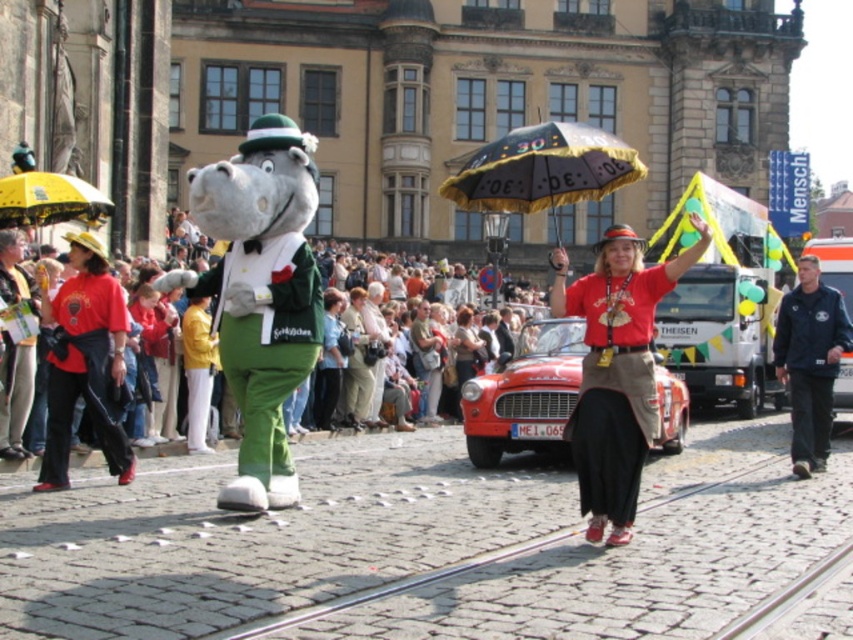
You are a photographer trying to capture a photo of the red cotton shirt at center and the yellow fabric umbrella at upper left. Which object should you focus on first if you want to include both in your shot without moving the camera?

The red cotton shirt at center is much taller than the yellow fabric umbrella at upper left, so you should focus on the red cotton shirt at center first to ensure it fits within the frame.

You are a photographer trying to capture the shiny red car at center in your shot. The camera has a focal length of 50mm and you are positioned at the origin point. What is the angle of view required to ensure the car is centered in the frame?

The shiny red car at center is located at coordinates (525, 394). To center it in the frame with a 50mm focal length, the angle of view should be calculated using the camera position at the origin and the car coordinates to ensure proper framing.

You are a photographer at the event and want to capture the red cotton shirt at center without the black satin umbrella at center blocking it. How should you adjust your camera angle?

The red cotton shirt at center is below the black satin umbrella at center, so you can lower your camera angle to capture the red cotton shirt at center while avoiding the umbrella.